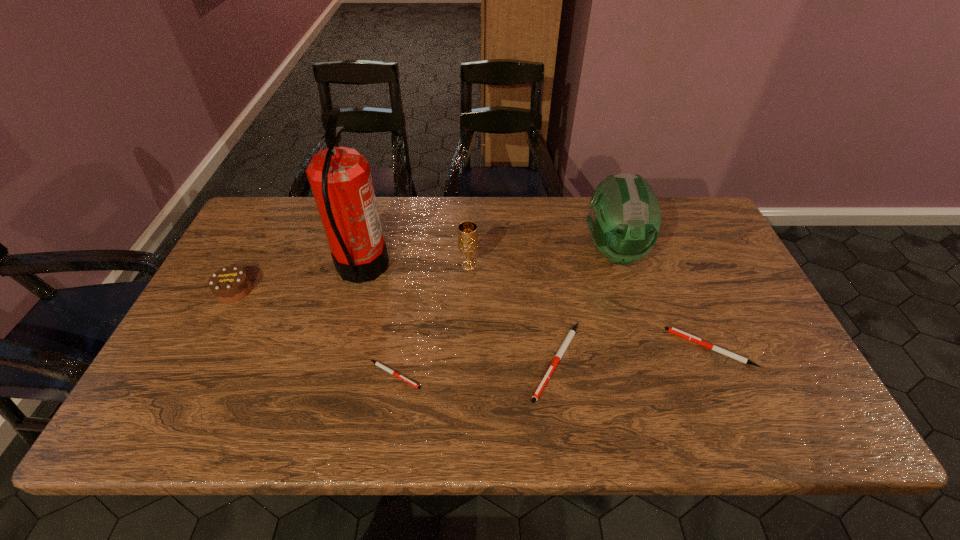
Where is `blank space at the near left corner of the desktop`? The image size is (960, 540). blank space at the near left corner of the desktop is located at coordinates (200, 387).

The height and width of the screenshot is (540, 960). What are the coordinates of `free area in between the fifth object from left to right and the sixth tallest object` in the screenshot? It's located at (633, 354).

The height and width of the screenshot is (540, 960). In order to click on empty space between the leftmost object and the rightmost pen in this screenshot , I will do `click(472, 319)`.

Locate an element on the screen. Image resolution: width=960 pixels, height=540 pixels. empty space between the sixth object from right to left and the fourth shortest object is located at coordinates (298, 279).

At what (x,y) coordinates should I click in order to perform the action: click on free space between the chocolate cake and the second shortest object. Please return your answer as a coordinate pair (x, y). The width and height of the screenshot is (960, 540). Looking at the image, I should click on (472, 319).

The width and height of the screenshot is (960, 540). I want to click on vacant space that is in between the sixth shortest object and the fifth object from left to right, so click(x=586, y=306).

Identify the location of blank region between the fourth shortest object and the third object from left to right. (314, 333).

Where is `free spot between the tallest object and the shortest pen`? Image resolution: width=960 pixels, height=540 pixels. free spot between the tallest object and the shortest pen is located at coordinates (378, 322).

Locate an element on the screen. This screenshot has width=960, height=540. vacant space that is in between the sixth object from right to left and the rightmost pen is located at coordinates (536, 308).

The height and width of the screenshot is (540, 960). Find the location of `empty space that is in between the leftmost object and the fire extinguisher`. empty space that is in between the leftmost object and the fire extinguisher is located at coordinates (298, 279).